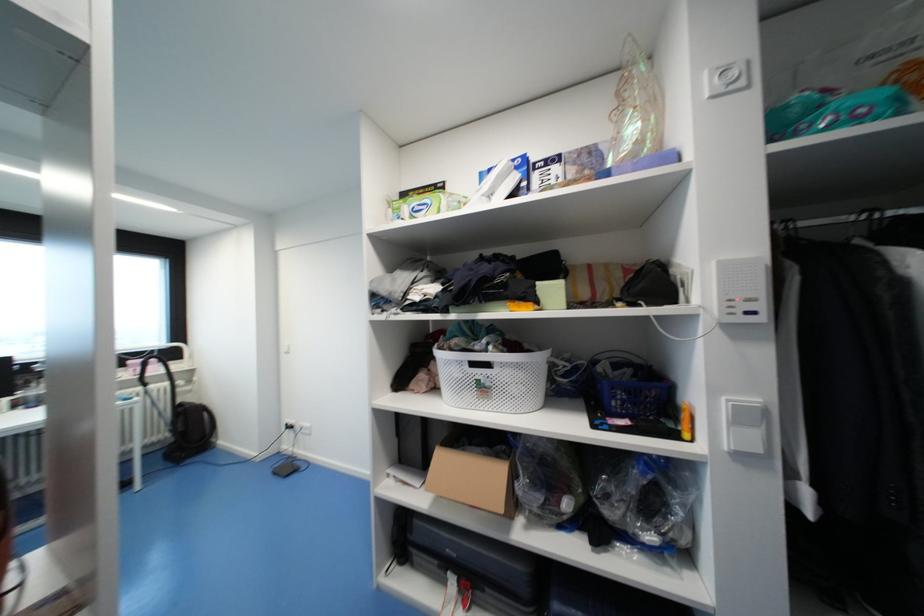
At what (x,y) coordinates should I click in order to perform the action: click on clothes hanger. Please return your answer as a coordinate pair (x, y). Looking at the image, I should click on (845, 217).